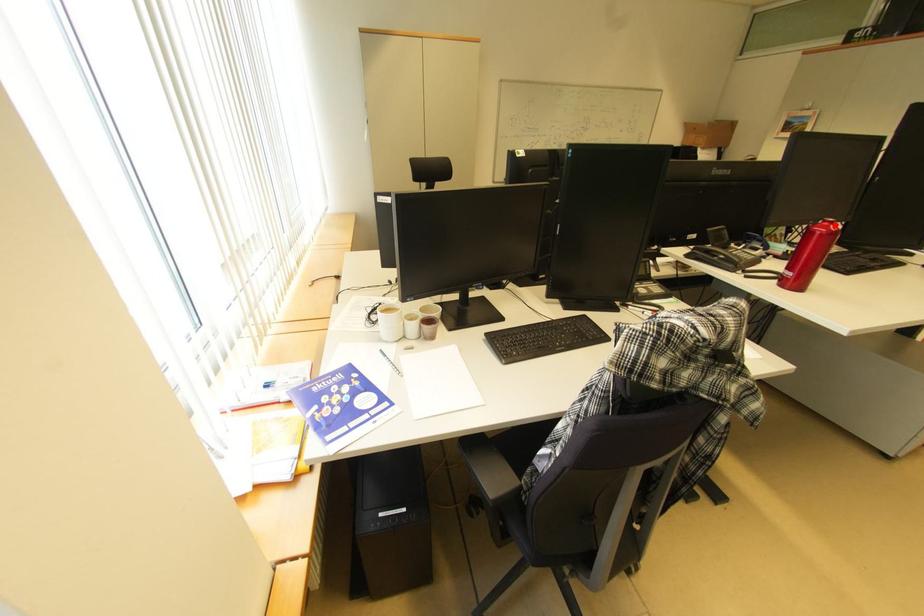
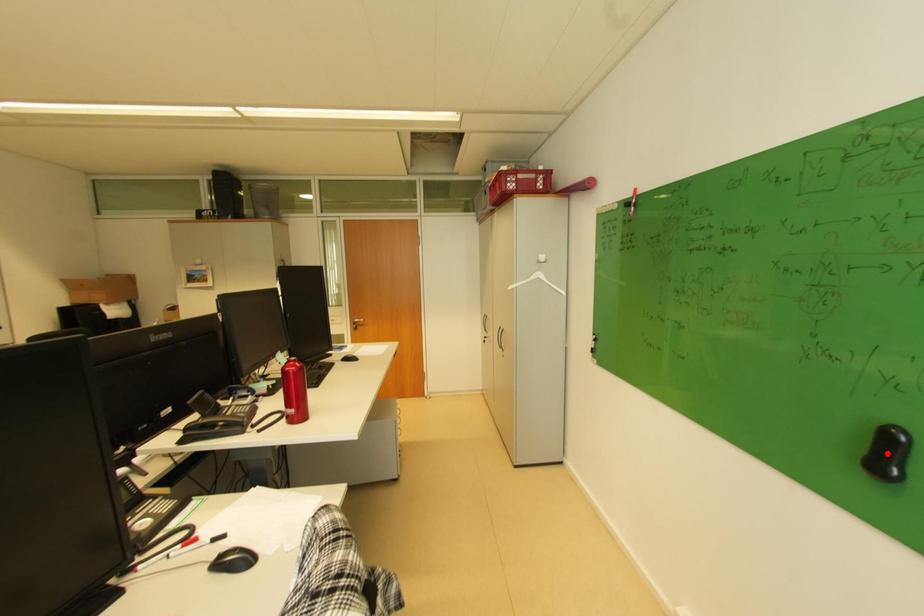
I am providing you with two images of the same scene from different viewpoints. A red point is marked on the first image and another point is marked on the second image. Does the point marked in image1 correspond to the same location as the one in image2?

No